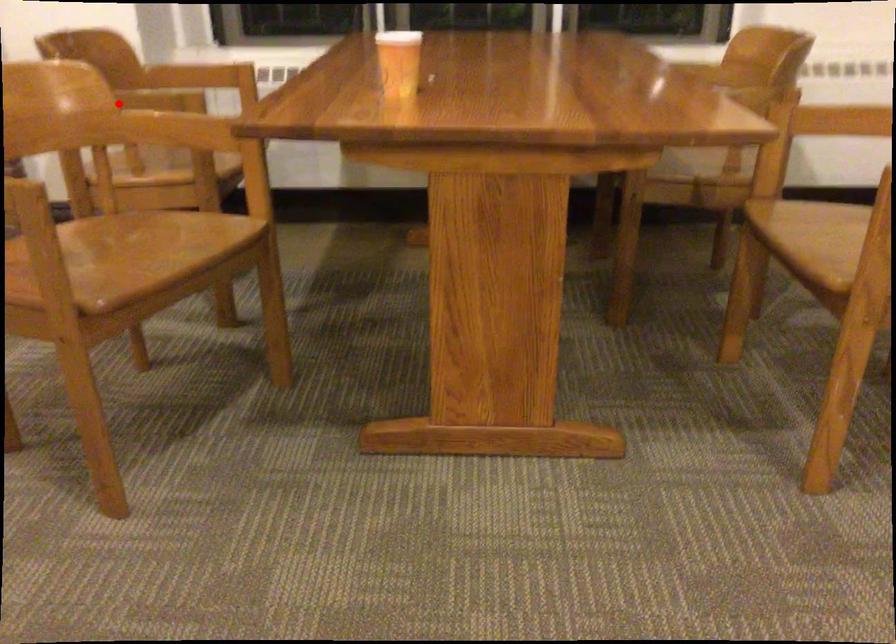
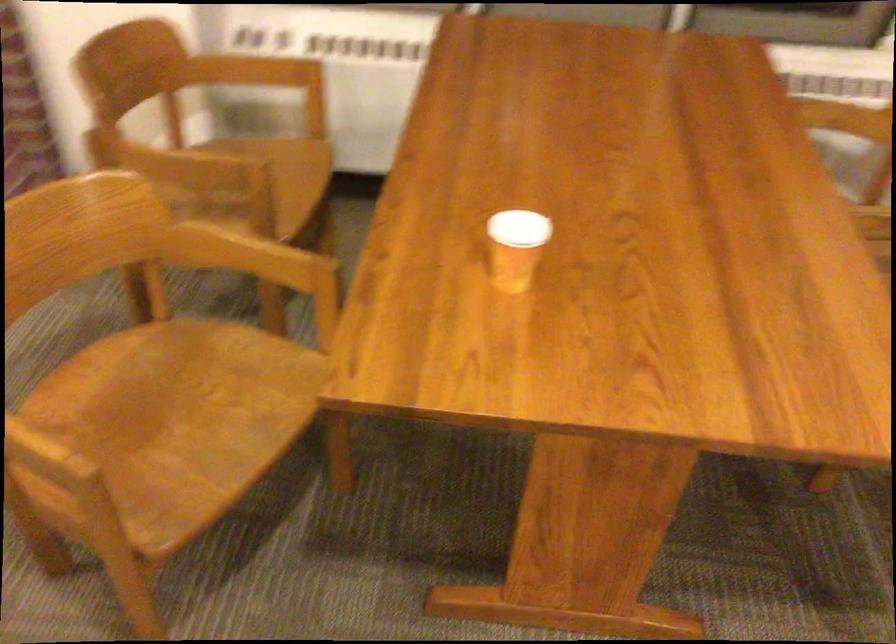
Locate, in the second image, the point that corresponds to the highlighted location in the first image.

(169, 163)